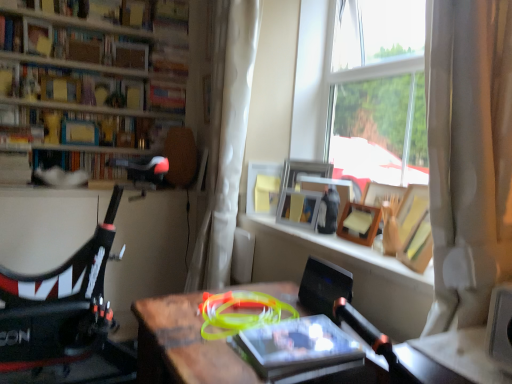
Question: Considering the relative positions of wooden frame at upper center and matte yellow book at upper left, the 2th book in the front-to-back sequence, in the image provided, is wooden frame at upper center to the left of matte yellow book at upper left, the 2th book in the front-to-back sequence, from the viewer's perspective?

Choices:
 (A) yes
 (B) no

Answer: (B)

Question: From the image's perspective, does wooden frame at upper center appear lower than matte yellow book at upper left, the 1th book when ordered from top to bottom?

Choices:
 (A) no
 (B) yes

Answer: (B)

Question: Can you confirm if wooden frame at upper center is taller than matte yellow book at upper left, the 2th book in the front-to-back sequence?

Choices:
 (A) yes
 (B) no

Answer: (B)

Question: From the image's perspective, is wooden frame at upper center above matte yellow book at upper left, the 1th book when ordered from top to bottom?

Choices:
 (A) no
 (B) yes

Answer: (A)

Question: Can you confirm if wooden frame at upper center is shorter than matte yellow book at upper left, the 1th book when ordered from top to bottom?

Choices:
 (A) yes
 (B) no

Answer: (A)

Question: Is wooden frame at upper center at the right side of matte yellow book at upper left, the 1th book when ordered from top to bottom?

Choices:
 (A) no
 (B) yes

Answer: (B)

Question: Does white sheer curtain at center come behind matte black bookshelf at center, which is the 2th book from back to front?

Choices:
 (A) yes
 (B) no

Answer: (B)

Question: Does white sheer curtain at center touch matte black bookshelf at center, placed as the second book when sorted from bottom to top?

Choices:
 (A) yes
 (B) no

Answer: (B)

Question: Are white sheer curtain at center and matte black bookshelf at center, the 4th book in the top-to-bottom sequence, far apart?

Choices:
 (A) no
 (B) yes

Answer: (A)

Question: Could you tell me if white sheer curtain at center is facing matte black bookshelf at center, which is the 2th book from back to front?

Choices:
 (A) yes
 (B) no

Answer: (B)

Question: Considering the relative sizes of white sheer curtain at center and matte black bookshelf at center, placed as the second book when sorted from bottom to top, in the image provided, is white sheer curtain at center taller than matte black bookshelf at center, placed as the second book when sorted from bottom to top,?

Choices:
 (A) no
 (B) yes

Answer: (B)

Question: Can you confirm if white sheer curtain at center is shorter than matte black bookshelf at center, which is the 2th book from back to front?

Choices:
 (A) yes
 (B) no

Answer: (B)

Question: Considering the relative sizes of hardcover book at upper center, acting as the 5th book starting from the front, and wooden picture frame at window, placed as the first picture frame when sorted from right to left, in the image provided, is hardcover book at upper center, acting as the 5th book starting from the front, wider than wooden picture frame at window, placed as the first picture frame when sorted from right to left,?

Choices:
 (A) no
 (B) yes

Answer: (B)